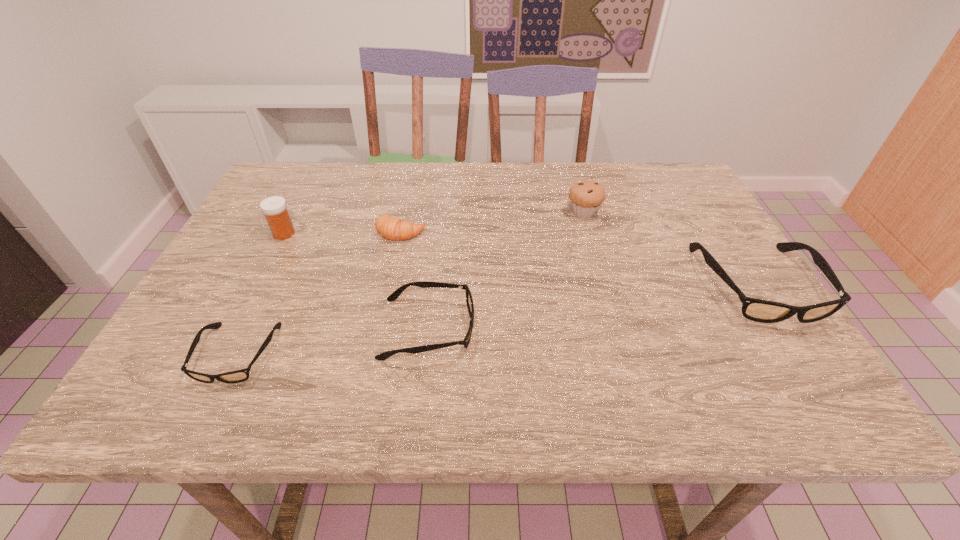
Where is `blank area located on the back of the medicine`? This screenshot has width=960, height=540. blank area located on the back of the medicine is located at coordinates (317, 168).

The height and width of the screenshot is (540, 960). I want to click on free region located on the right of the crescent roll, so click(x=547, y=231).

Where is `vacant region located on the right of the fifth object from left to right`? vacant region located on the right of the fifth object from left to right is located at coordinates (657, 213).

Find the location of a particular element. object located in the far edge section of the desktop is located at coordinates (586, 196).

Locate an element on the screen. The width and height of the screenshot is (960, 540). spectacles at the left edge is located at coordinates (237, 376).

Image resolution: width=960 pixels, height=540 pixels. I want to click on medicine situated at the left edge, so click(274, 208).

The width and height of the screenshot is (960, 540). Find the location of `object present at the right edge`. object present at the right edge is located at coordinates (758, 310).

At what (x,y) coordinates should I click in order to perform the action: click on object at the near left corner. Please return your answer as a coordinate pair (x, y). The height and width of the screenshot is (540, 960). Looking at the image, I should click on (237, 376).

At what (x,y) coordinates should I click in order to perform the action: click on blank space at the far edge of the desktop. Please return your answer as a coordinate pair (x, y). This screenshot has height=540, width=960. Looking at the image, I should click on (392, 163).

Find the location of a particular element. vacant area at the near edge of the desktop is located at coordinates (401, 346).